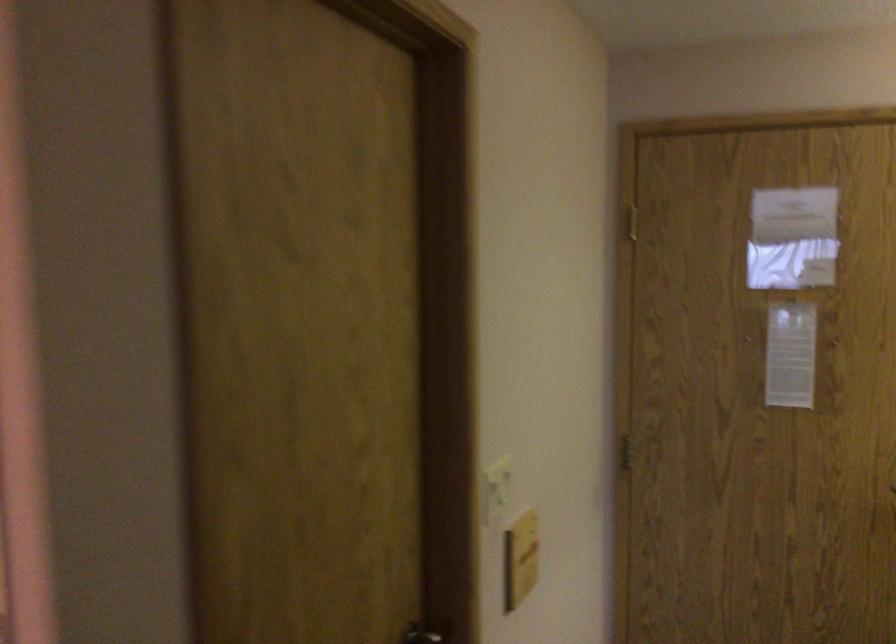
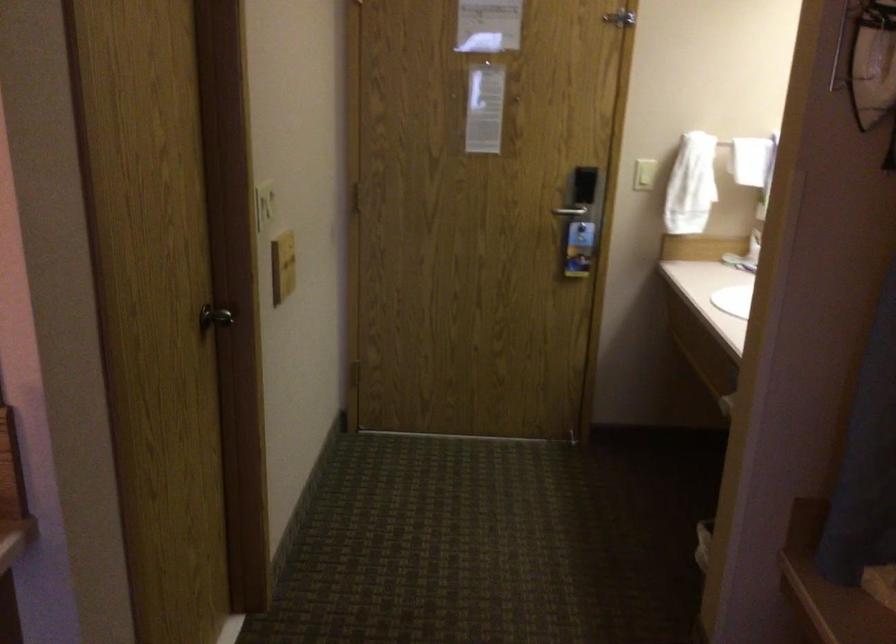
What movement of the cameraman would produce the second image?

The cameraman moved toward left, backward.